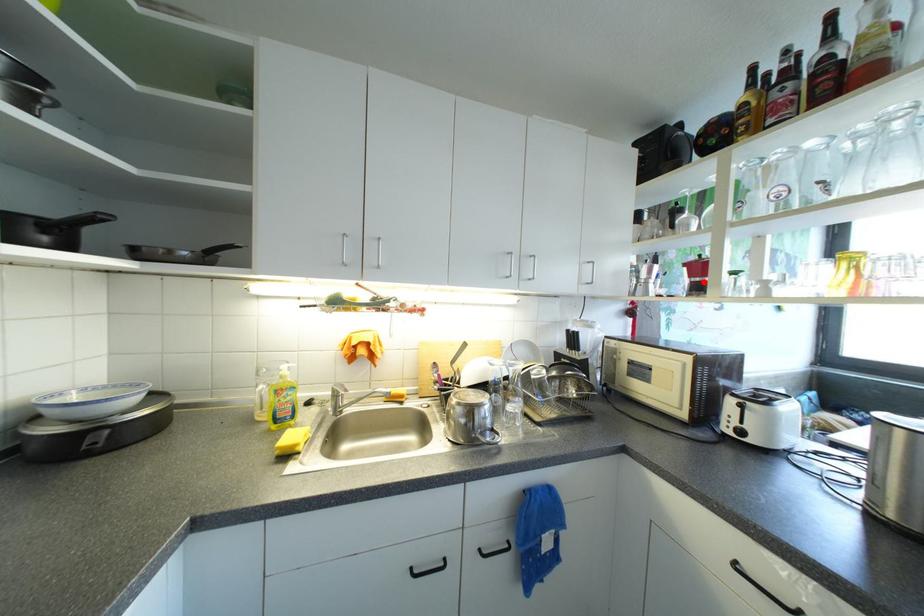
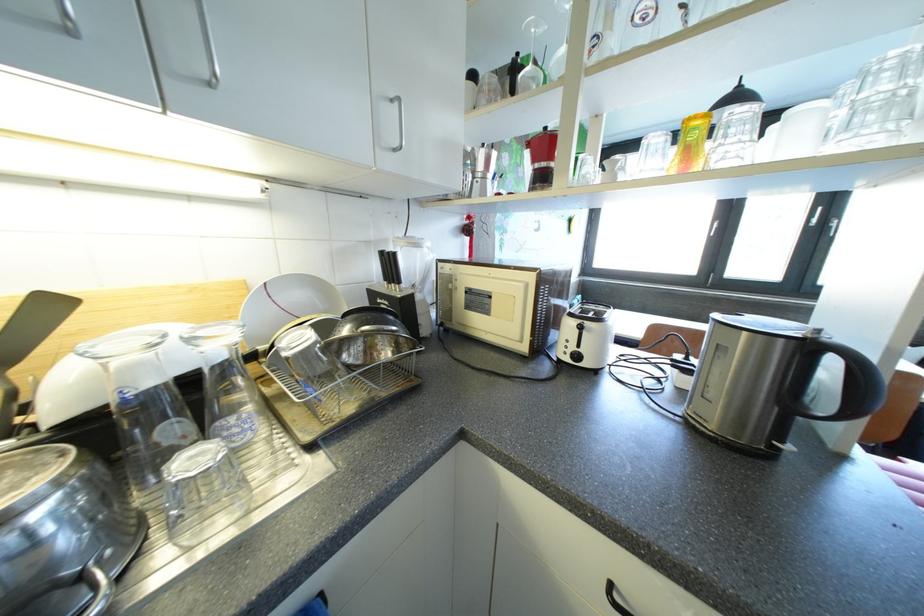
Find the pixel in the second image that matches the highlighted location in the first image.

(549, 168)